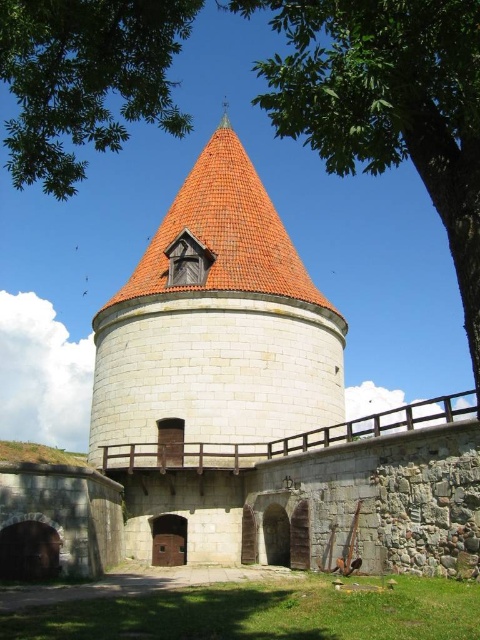
You are standing at point (387, 104) in the image. What do you see directly in front of you?

You see a green leafy tree at upper center directly in front of you at point (387, 104).

You are standing in front of the historic stone tower and want to take a photo. You notice two points marked on the ground at coordinates point (287, 38) and point (24, 104). Which point is closer to your camera position?

Point (287, 38) is further to the camera than point (24, 104), so the point closer to your camera position is point (24, 104).

You are an architect designing a new garden layout. You have two green leafy trees to place in the scene. The trees are labeled as the green leafy tree at upper center and the green leafy tree at upper left. Which tree should you choose if you want to plant a smaller tree closer to the historic stone tower?

The green leafy tree at upper center has a smaller size compared to the green leafy tree at upper left, so you should choose the green leafy tree at upper center to plant a smaller tree closer to the historic stone tower.